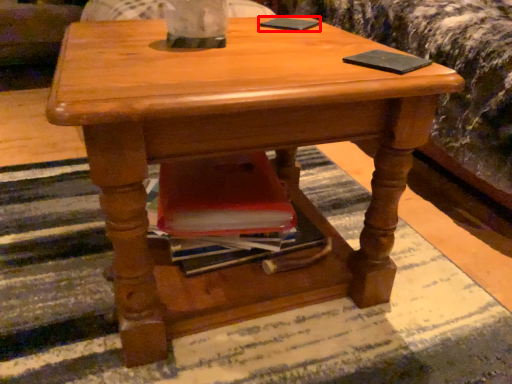
Question: From the image's perspective, considering the relative positions of pad (annotated by the red box) and pad in the image provided, where is pad (annotated by the red box) located with respect to the staircase?

Choices:
 (A) below
 (B) above

Answer: (B)